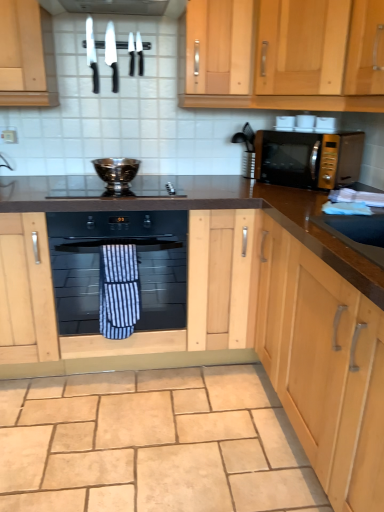
Question: From the image's perspective, is black glass gas stove at center beneath beige stone floor at lower center?

Choices:
 (A) no
 (B) yes

Answer: (A)

Question: Is black glass gas stove at center bigger than beige stone floor at lower center?

Choices:
 (A) yes
 (B) no

Answer: (B)

Question: From a real-world perspective, does black glass gas stove at center sit lower than beige stone floor at lower center?

Choices:
 (A) yes
 (B) no

Answer: (B)

Question: Is black glass gas stove at center positioned in front of beige stone floor at lower center?

Choices:
 (A) no
 (B) yes

Answer: (A)

Question: Is black glass gas stove at center not within beige stone floor at lower center?

Choices:
 (A) no
 (B) yes

Answer: (B)

Question: Is black matte oven at center, positioned as the second cabinetry in top-to-bottom order, bigger or smaller than shiny silver knife at upper center, positioned as the 3th knife in right-to-left order?

Choices:
 (A) small
 (B) big

Answer: (B)

Question: Considering the positions of black matte oven at center, positioned as the second cabinetry in top-to-bottom order, and shiny silver knife at upper center, positioned as the second knife in left-to-right order, in the image, is black matte oven at center, positioned as the second cabinetry in top-to-bottom order, wider or thinner than shiny silver knife at upper center, positioned as the second knife in left-to-right order,?

Choices:
 (A) wide
 (B) thin

Answer: (A)

Question: Is point (152, 347) closer or farther from the camera than point (114, 59)?

Choices:
 (A) closer
 (B) farther

Answer: (A)

Question: Would you say black matte oven at center, positioned as the second cabinetry in top-to-bottom order, is to the left or to the right of shiny silver knife at upper center, positioned as the 3th knife in right-to-left order, in the picture?

Choices:
 (A) left
 (B) right

Answer: (A)

Question: Considering the positions of blue striped towel at center and shiny silver knife at upper left, the fourth knife viewed from the right, in the image, is blue striped towel at center wider or thinner than shiny silver knife at upper left, the fourth knife viewed from the right,?

Choices:
 (A) wide
 (B) thin

Answer: (A)

Question: Relative to shiny silver knife at upper left, which appears as the first knife when viewed from the left, is blue striped towel at center in front or behind?

Choices:
 (A) front
 (B) behind

Answer: (A)

Question: In the image, is blue striped towel at center on the left side or the right side of shiny silver knife at upper left, which appears as the first knife when viewed from the left?

Choices:
 (A) left
 (B) right

Answer: (B)

Question: From a real-world perspective, is blue striped towel at center above or below shiny silver knife at upper left, the fourth knife viewed from the right?

Choices:
 (A) below
 (B) above

Answer: (A)

Question: Does point (x=119, y=170) appear closer or farther from the camera than point (x=112, y=272)?

Choices:
 (A) farther
 (B) closer

Answer: (A)

Question: Is silver metallic bowl at center in front of or behind black glass oven at center in the image?

Choices:
 (A) behind
 (B) front

Answer: (A)